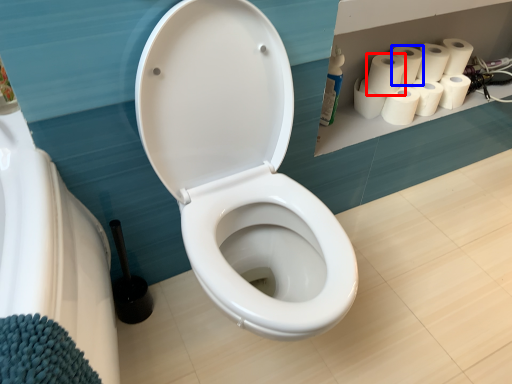
Question: Which point is further to the camera, paper towel (highlighted by a red box) or paper towel (highlighted by a blue box)?

Choices:
 (A) paper towel
 (B) paper towel

Answer: (B)